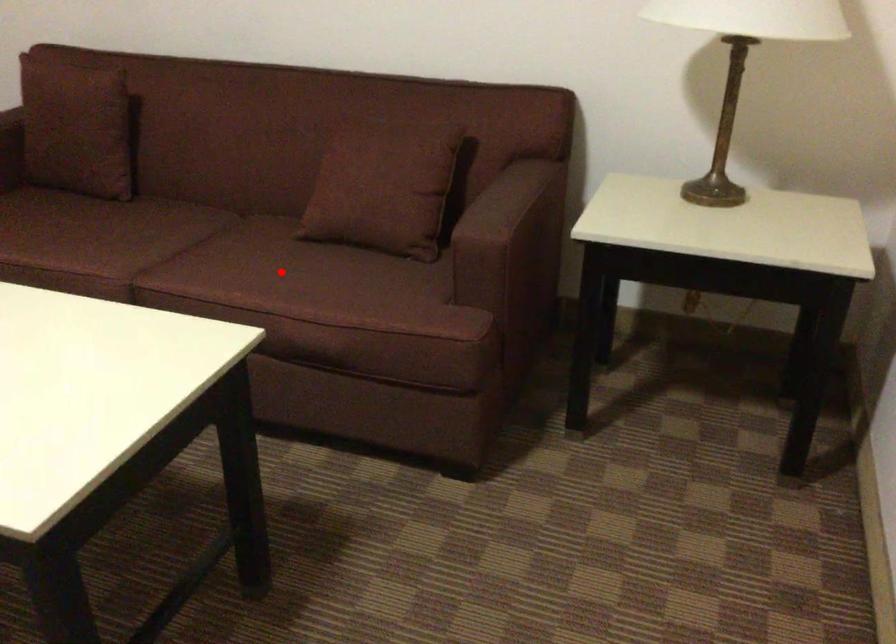
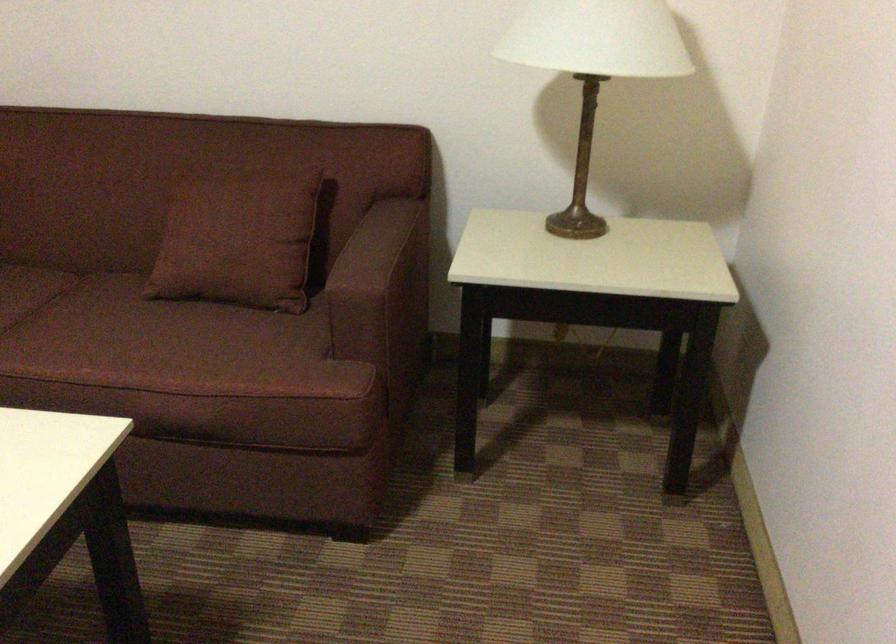
Question: I am providing you with two images of the same scene from different viewpoints. Image1 has a red point marked. In image2, the corresponding 3D location appears at what relative position? Reply with the corresponding letter.

Choices:
 (A) Closer
 (B) Farther

Answer: (A)